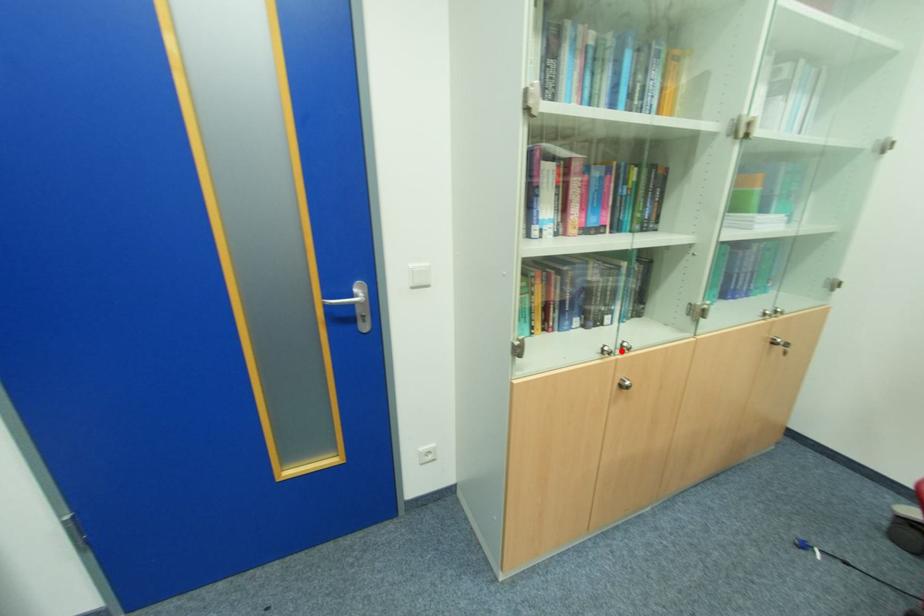
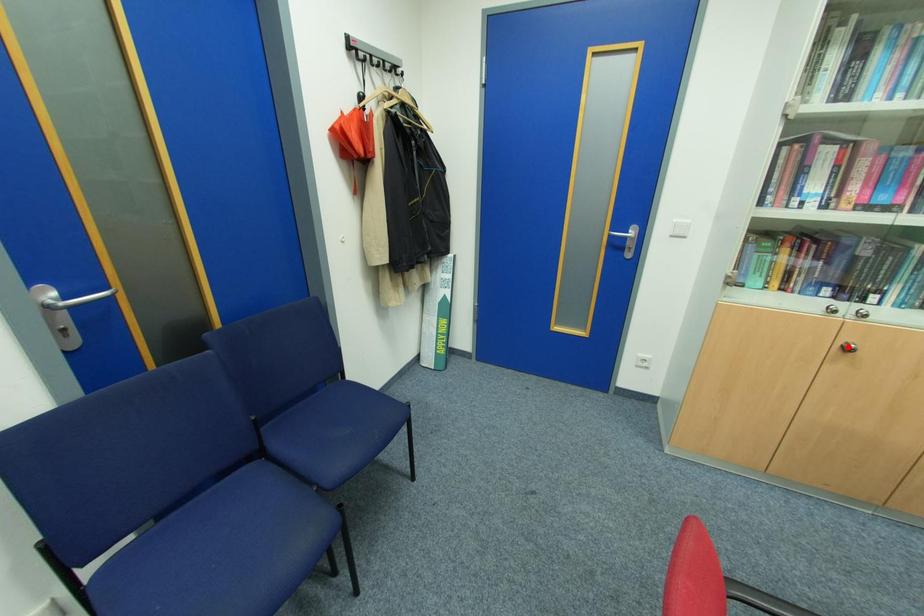
I am providing you with two images of the same scene from different viewpoints. A red point is marked on the first image and another point is marked on the second image. Does the point marked in image1 correspond to the same location as the one in image2?

No